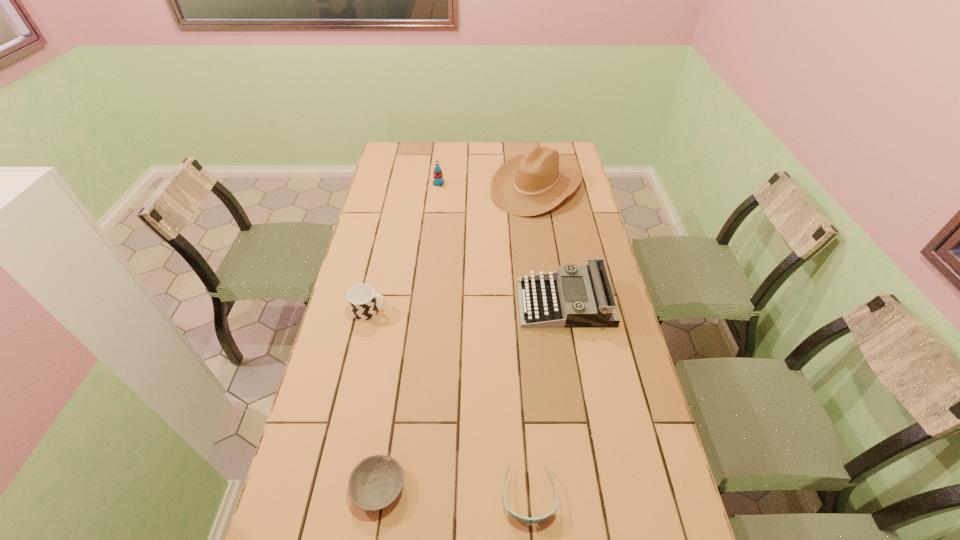
In the image, there is a desktop. Identify the location of vacant space at the left edge. This screenshot has height=540, width=960. (374, 287).

At what (x,y) coordinates should I click in order to perform the action: click on free space at the right edge of the desktop. Please return your answer as a coordinate pair (x, y). The height and width of the screenshot is (540, 960). Looking at the image, I should click on (616, 491).

In the image, there is a desktop. At what (x,y) coordinates should I click in order to perform the action: click on vacant space at the far left corner. Please return your answer as a coordinate pair (x, y). This screenshot has width=960, height=540. Looking at the image, I should click on (405, 166).

Image resolution: width=960 pixels, height=540 pixels. I want to click on free space at the far right corner of the desktop, so click(567, 152).

You are a GUI agent. You are given a task and a screenshot of the screen. Output one action in this format:
    pyautogui.click(x=<x>, y=<y>)
    Task: Click on the blank region between the soda and the typewriter
    The width and height of the screenshot is (960, 540).
    Given the screenshot: What is the action you would take?
    pyautogui.click(x=502, y=243)

The image size is (960, 540). In order to click on free area in between the goggles and the bowl in this screenshot , I will do `click(454, 492)`.

You are a GUI agent. You are given a task and a screenshot of the screen. Output one action in this format:
    pyautogui.click(x=<x>, y=<y>)
    Task: Click on the empty space that is in between the soda and the typewriter
    This screenshot has width=960, height=540.
    Given the screenshot: What is the action you would take?
    pyautogui.click(x=502, y=243)

Find the location of `free space between the cup and the goggles`. free space between the cup and the goggles is located at coordinates (x=449, y=403).

Where is `free spot between the cowboy hat and the typewriter`? This screenshot has height=540, width=960. free spot between the cowboy hat and the typewriter is located at coordinates (550, 245).

Find the location of `vacant space that's between the soda and the cowboy hat`. vacant space that's between the soda and the cowboy hat is located at coordinates (488, 185).